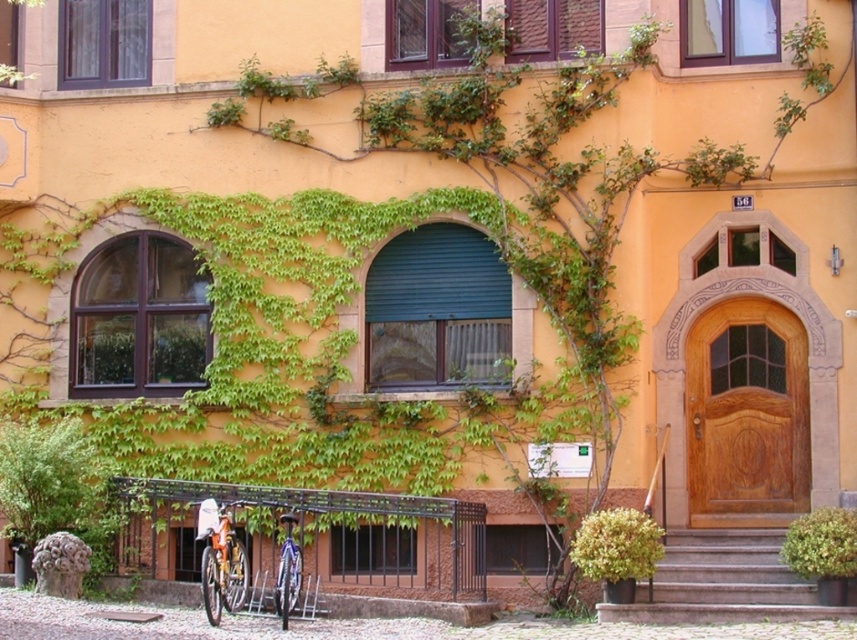
Question: Can you confirm if matte white shutter at upper left is thinner than orange matte bicycle at lower left?

Choices:
 (A) no
 (B) yes

Answer: (A)

Question: Where is wooden at upper center located in relation to green leafy bush at lower right in the image?

Choices:
 (A) right
 (B) left

Answer: (B)

Question: Which object appears closest to the camera in this image?

Choices:
 (A) orange matte bicycle at lower left
 (B) wooden at upper center

Answer: (A)

Question: Which point is closer to the camera taking this photo?

Choices:
 (A) (787, 547)
 (B) (73, 68)
 (C) (288, 518)
 (D) (618, 509)

Answer: (C)

Question: Is wooden at upper center further to camera compared to shiny blue bicycle at lower center?

Choices:
 (A) yes
 (B) no

Answer: (A)

Question: Among these points, which one is farthest from the camera?

Choices:
 (A) (238, 592)
 (B) (289, 598)
 (C) (597, 536)

Answer: (C)